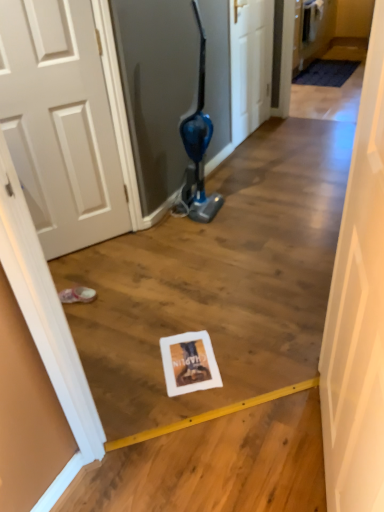
At what (x,y) coordinates should I click in order to perform the action: click on vacant space to the right of pink fabric footwear at lower left. Please return your answer as a coordinate pair (x, y). This screenshot has height=512, width=384. Looking at the image, I should click on (114, 295).